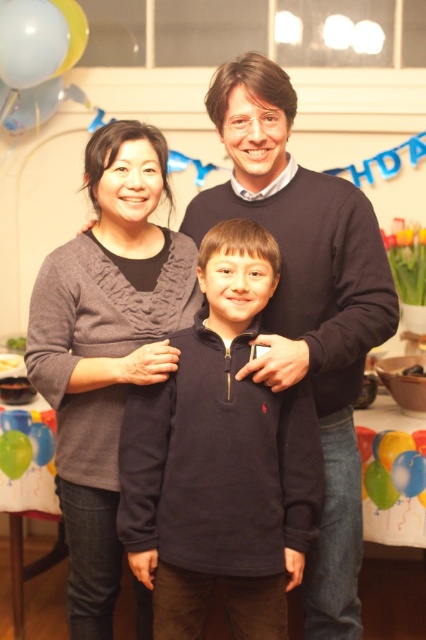
You are a photographer setting up for a birthday photo. You notice two sweaters in the scene, the dark blue sweater at center and the knitted gray sweater at center. Which one has a wider width?

The dark blue sweater at center has a larger width than the knitted gray sweater at center according to the description.

You are a photographer standing 2 meters away from the scene. You want to take a closeup photo of the point at coordinate (173, 461). Given that your camera has a maximum zoom range of 1.5 meters, will you be able to focus on that point effectively?

The distance of point (173, 461) from viewer is 1.41 meters, which is within the camera maximum zoom range of 1.5 meters. So yes, the photographer can focus on that point effectively.

In the scene shown: You are a photographer trying to capture a group photo of the family. The dark blue fleece at center and the knitted gray sweater at center are both visible in the frame. Based on their sizes, which clothing item will appear closer to the camera?

The dark blue fleece at center has a smaller size compared to the knitted gray sweater at center. Therefore, the knitted gray sweater at center must be closer to the camera to appear larger in the photo.